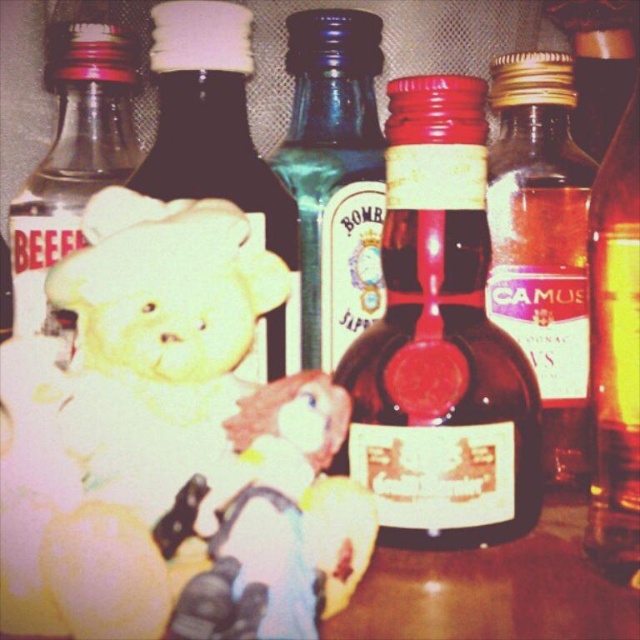
You are a delivery person who needs to place a new bottle of whiskey that is 14 inches long into the space between the translucent glass bottle at center and the teddy bear. Will the bottle fit in that space?

The space between the translucent glass bottle at center and the teddy bear is 14.18 inches, so the 14 inch whiskey bottle will fit with a small amount of space remaining.

You are a delivery person who needs to place a new bottle that is 5 centimeters wide between the translucent glass bottle at center and the white matte bear at left. Can you fit it there?

The distance between the translucent glass bottle at center and the white matte bear at left is 4.62 centimeters, which is less than the width of the new bottle. Therefore, the bottle cannot be placed there.